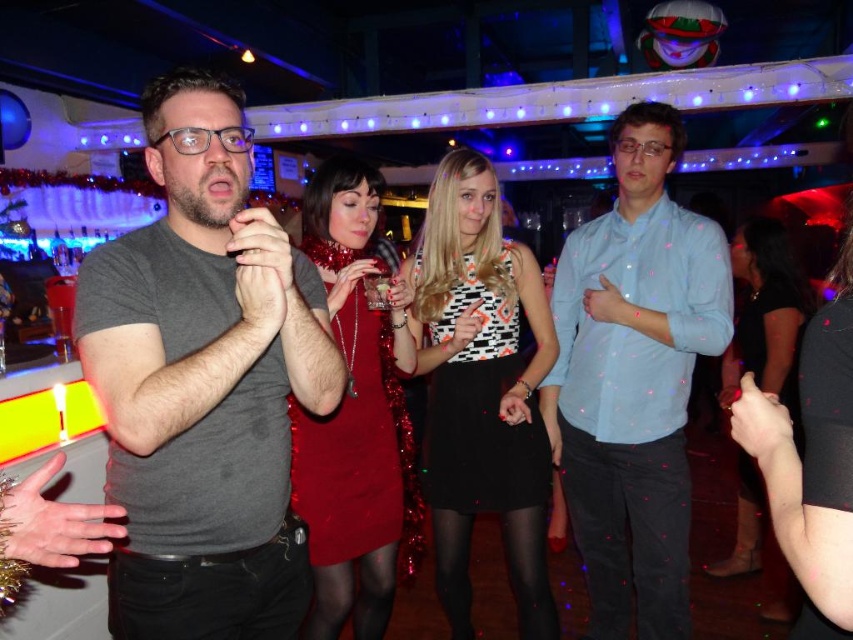
At what (x,y) coordinates should I click in order to perform the action: click on shiny red dress at center. Please return your answer as a coordinate pair (x, y). The height and width of the screenshot is (640, 853). Looking at the image, I should click on pos(354,417).

Between shiny red dress at center and black satin dress at lower right, which one appears on the left side from the viewer's perspective?

shiny red dress at center

Which is in front, point (367, 588) or point (751, 237)?

Point (367, 588) is in front.

This screenshot has height=640, width=853. In order to click on shiny red dress at center in this screenshot , I will do `click(354, 417)`.

Can you confirm if gray matte t-shirt at left is bigger than shiny red dress at center?

No.

Which is above, gray matte t-shirt at left or shiny red dress at center?

Positioned higher is gray matte t-shirt at left.

Find the location of `gray matte t-shirt at left`. gray matte t-shirt at left is located at coordinates [204, 381].

Locate an element on the screen. This screenshot has width=853, height=640. gray matte t-shirt at left is located at coordinates (204, 381).

Between gray matte t-shirt at left and light blue shirt at center, which one has less height?

gray matte t-shirt at left is shorter.

Is the position of gray matte t-shirt at left less distant than that of light blue shirt at center?

Yes.

Who is more distant from viewer, (x=310, y=360) or (x=641, y=259)?

Positioned behind is point (x=641, y=259).

Where is `gray matte t-shirt at left`? The width and height of the screenshot is (853, 640). gray matte t-shirt at left is located at coordinates (204, 381).